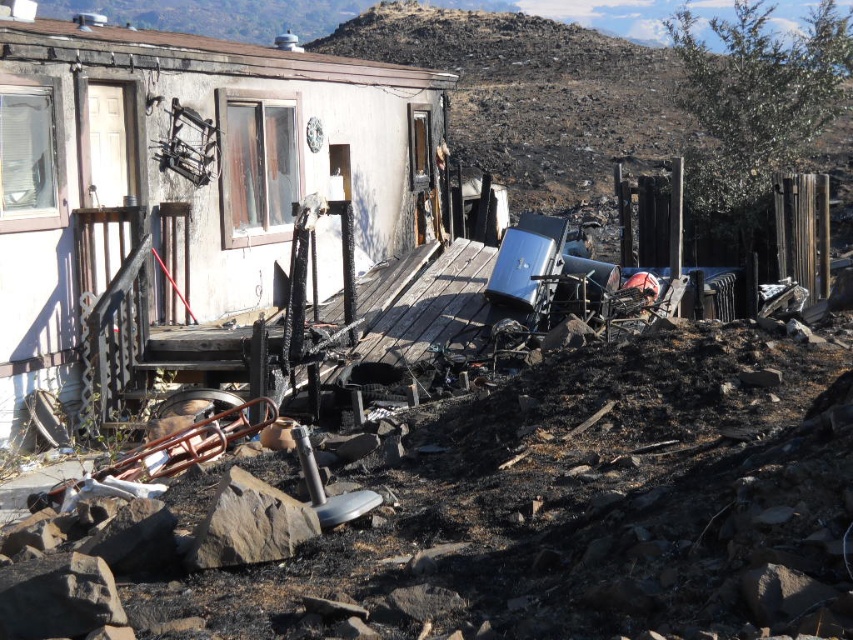
Question: Which object appears farthest from the camera in this image?

Choices:
 (A) brown rough rock at lower center
 (B) burnt soil at upper center

Answer: (B)

Question: Is burnt soil at upper center positioned at the back of brown rough rock at lower center?

Choices:
 (A) yes
 (B) no

Answer: (A)

Question: Is burnt soil at upper center below brown rough rock at lower center?

Choices:
 (A) yes
 (B) no

Answer: (B)

Question: Which object is farther from the camera taking this photo?

Choices:
 (A) brown rough rock at lower center
 (B) burnt soil at upper center

Answer: (B)

Question: Can you confirm if burnt soil at upper center is positioned below brown rough rock at lower center?

Choices:
 (A) yes
 (B) no

Answer: (B)